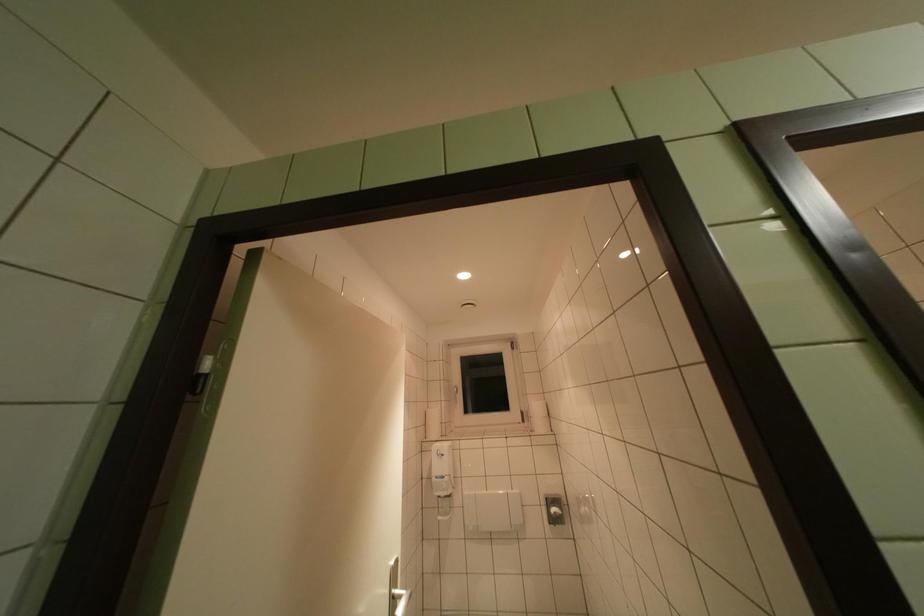
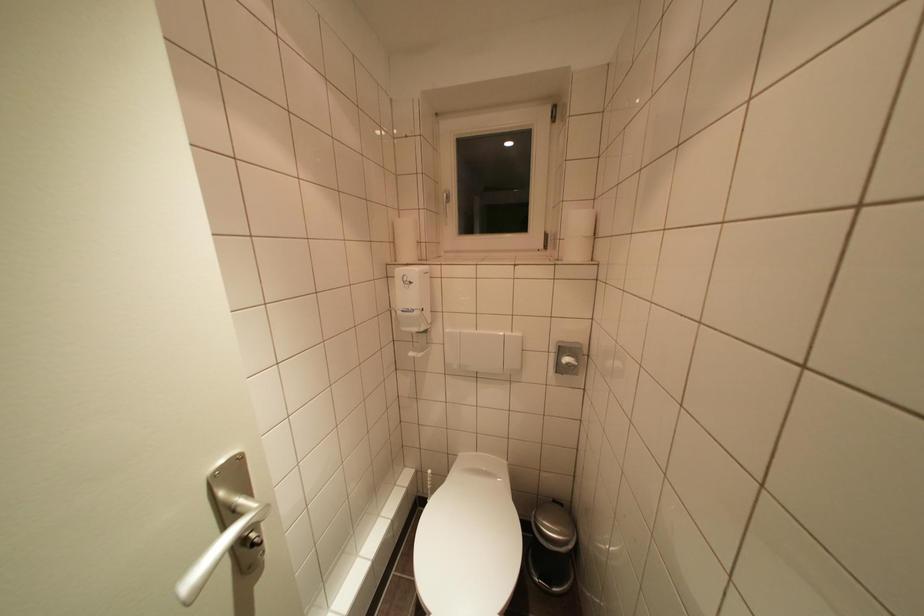
Where in the second image is the point corresponding to point 441,482 from the first image?

(406, 315)